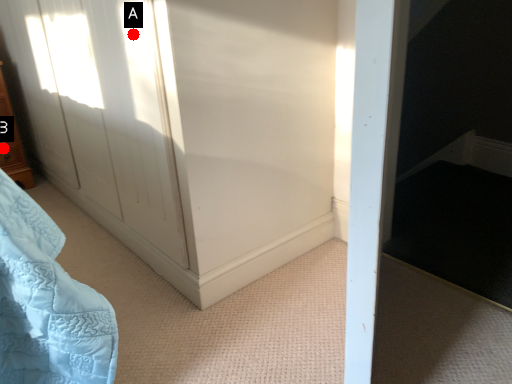
Question: Two points are circled on the image, labeled by A and B beside each circle. Which point is farther from the camera taking this photo?

Choices:
 (A) A is further
 (B) B is further

Answer: (B)